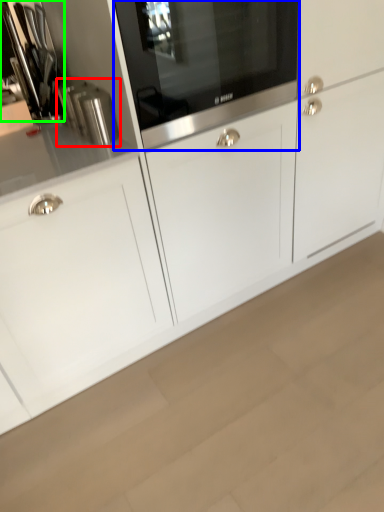
Question: Which is farther away from kitchen appliance (highlighted by a red box)? home appliance (highlighted by a blue box) or appliance (highlighted by a green box)?

Choices:
 (A) home appliance
 (B) appliance

Answer: (A)